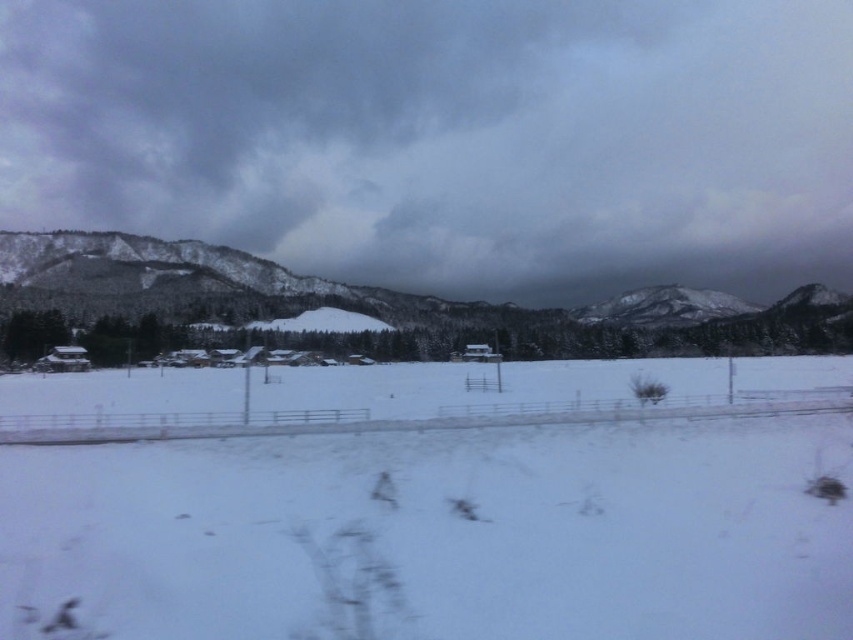
Question: Which object is the closest to the snowy rock at center?

Choices:
 (A) transparent glass train window at center
 (B) gray cloudy sky at upper center
 (C) white powdery snow at center

Answer: (B)

Question: Which object appears closest to the camera in this image?

Choices:
 (A) gray cloudy sky at upper center
 (B) snow-covered mountain at center
 (C) white powdery snow at center
 (D) snowy rock at center

Answer: (C)

Question: In this image, where is snow-covered mountain at center located relative to transparent glass train window at center?

Choices:
 (A) left
 (B) right

Answer: (B)

Question: Does snow-covered mountain at center have a lesser width compared to transparent glass train window at center?

Choices:
 (A) no
 (B) yes

Answer: (A)

Question: Is the position of white powdery snow at center more distant than that of snow-covered mountain at center?

Choices:
 (A) no
 (B) yes

Answer: (A)

Question: Which of these objects is positioned farthest from the gray cloudy sky at upper center?

Choices:
 (A) snowy rock at center
 (B) white powdery snow at center
 (C) snow-covered mountain at center
 (D) transparent glass train window at center

Answer: (B)